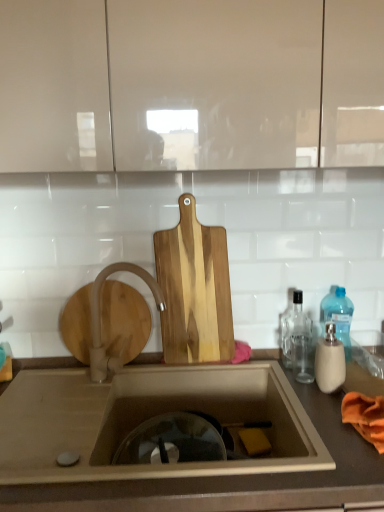
Find the location of a particular element. Image resolution: width=384 pixels, height=512 pixels. free space to the right of natural wood cutting board at center is located at coordinates (253, 367).